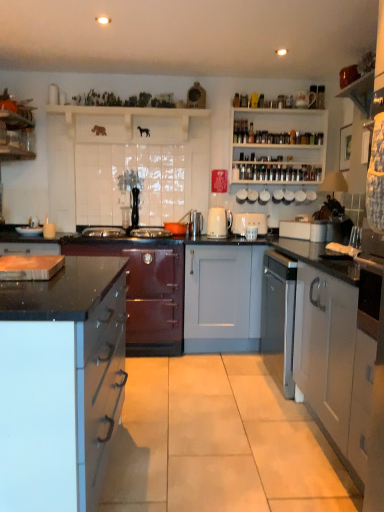
Question: Is white ceramic mug at upper center, marked as the 2th appliance in a left-to-right arrangement, inside or outside of white wooden shelves at upper right, which is counted as the 2th shelf, starting from the left?

Choices:
 (A) outside
 (B) inside

Answer: (A)

Question: Is point (241, 192) positioned closer to the camera than point (238, 167)?

Choices:
 (A) farther
 (B) closer

Answer: (A)

Question: Based on their relative distances, which object is farther from the white ceramic cup at upper center, the first appliance in the right-to-left sequence?

Choices:
 (A) white matte cabinet at right, which is the 3th cabinetry in left-to-right order
 (B) white glossy kettle at center, the 5th appliance positioned from the right
 (C) shiny burgundy cabinet at center-left, the first cabinetry positioned from the back
 (D) white wooden shelves at upper right, which ranks as the 1th shelf in right-to-left order
 (E) white glossy cabinet at lower left, the third cabinetry from the right

Answer: (E)

Question: Which of these objects is positioned farthest from the white wooden shelves at upper right, which ranks as the 1th shelf in right-to-left order?

Choices:
 (A) white ceramic kettle at upper center, the fourth appliance viewed from the left
 (B) white glossy kettle at center, the 5th appliance positioned from the right
 (C) white glossy cabinet at lower left, the first cabinetry viewed from the front
 (D) white matte cabinet at right, which is the second cabinetry from back to front
 (E) white wooden shelf at upper center, which is counted as the first shelf, starting from the left

Answer: (C)